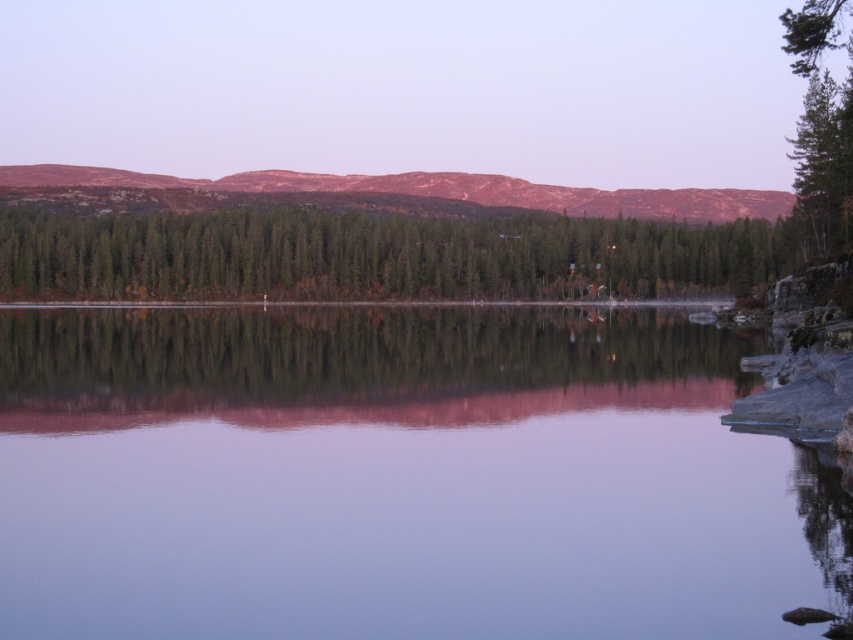
Does transparent water at center appear on the left side of green textured tree at right?

Yes, transparent water at center is to the left of green textured tree at right.

Who is higher up, transparent water at center or green textured tree at right?

Positioned higher is green textured tree at right.

Is point (294, 348) positioned after point (830, 186)?

No, it is not.

At what (x,y) coordinates should I click in order to perform the action: click on transparent water at center. Please return your answer as a coordinate pair (x, y). Looking at the image, I should click on (399, 477).

Does green matte trees at center have a greater width compared to rustic brown mountain at upper center?

No.

Is green matte trees at center to the left of rustic brown mountain at upper center from the viewer's perspective?

Incorrect, green matte trees at center is not on the left side of rustic brown mountain at upper center.

Is point (4, 298) farther from camera compared to point (677, 212)?

No.

In order to click on green matte trees at center in this screenshot , I will do `click(374, 256)`.

Is rustic brown mountain at upper center closer to camera compared to green textured tree at right?

No, it is not.

Can you confirm if rustic brown mountain at upper center is taller than green textured tree at right?

No, rustic brown mountain at upper center is not taller than green textured tree at right.

Locate an element on the screen. The image size is (853, 640). rustic brown mountain at upper center is located at coordinates (437, 189).

I want to click on rustic brown mountain at upper center, so pos(437,189).